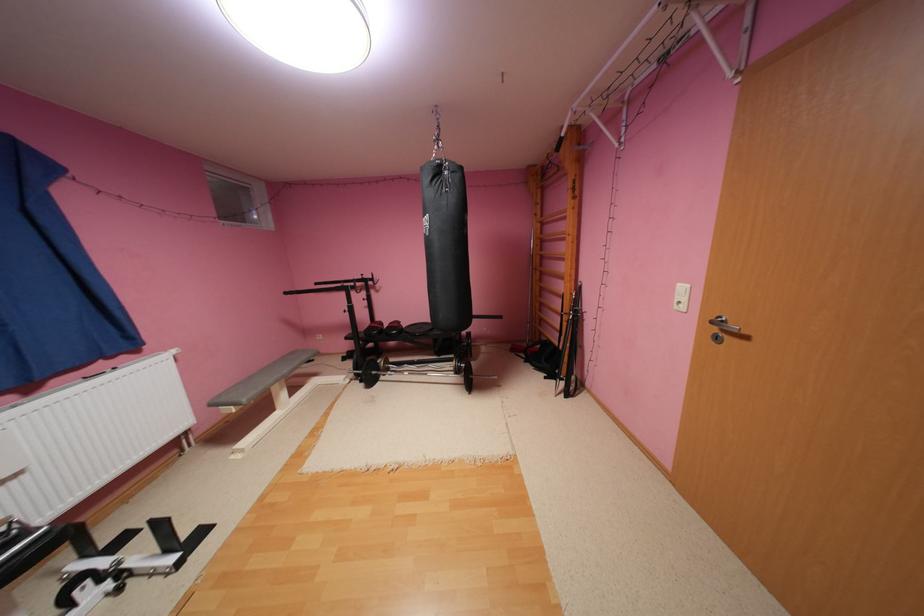
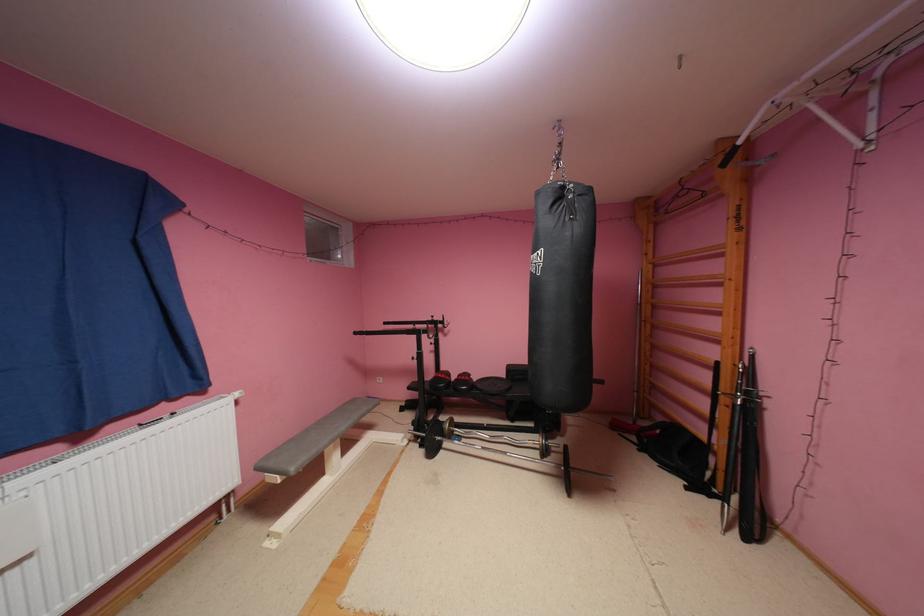
What movement of the cameraman would produce the second image?

The cameraman walked toward left, forward.